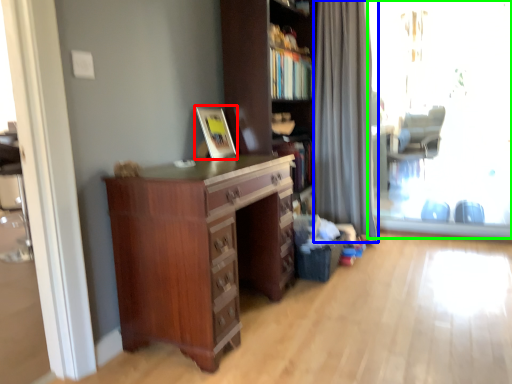
Question: Which object is the closest to the picture frame (highlighted by a red box)? Choose among these: curtain (highlighted by a blue box) or window screen (highlighted by a green box).

Choices:
 (A) curtain
 (B) window screen

Answer: (A)